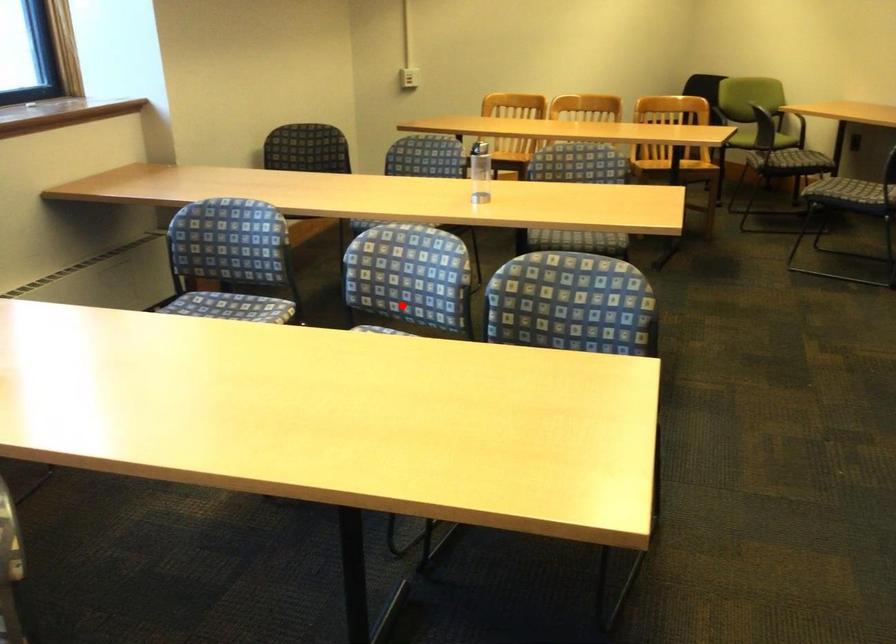
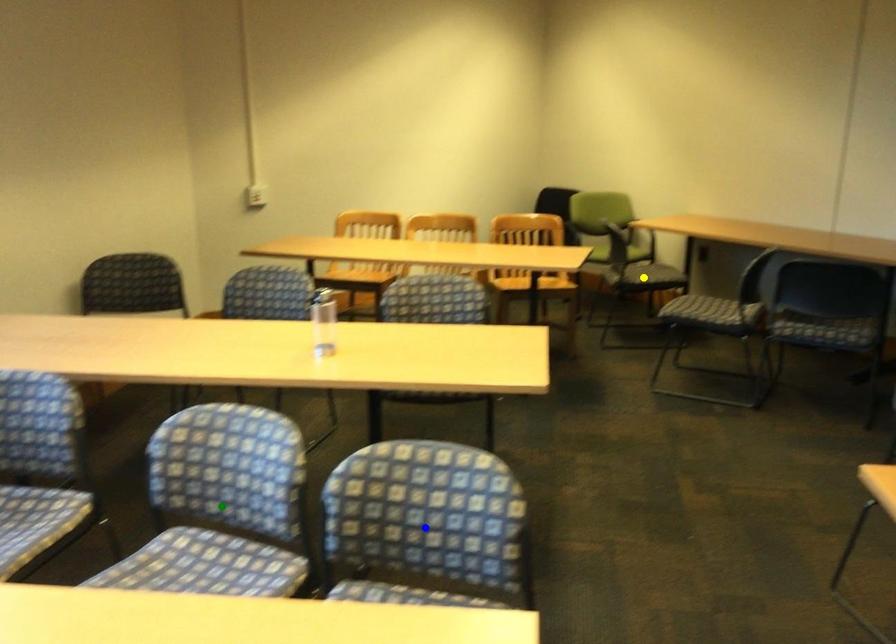
Question: I am providing you with two images of the same scene from different viewpoints. A red point is marked on the first image. You are given multiple points on the second image. In image 2, which mark is for the same physical point as the one in image 1?

Choices:
 (A) green point
 (B) blue point
 (C) yellow point

Answer: (A)